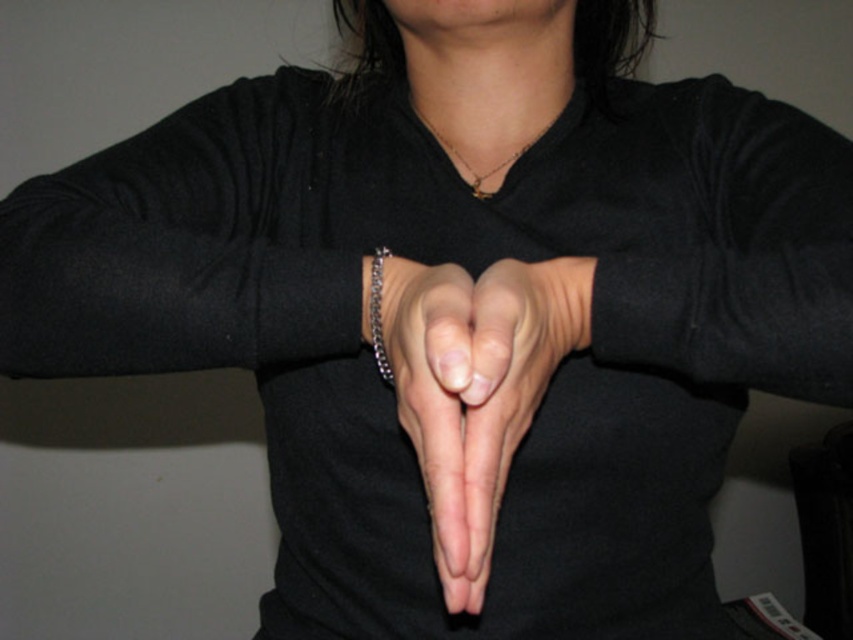
You are a photographer adjusting the lighting for a closeup shot of a person. The subject has their arms extended forward with their hands forming a heart shape. You need to ensure that the smooth skin hand at center is well lit. Based on the scene description, where should you position the main light relative to the subject?

The smooth skin hand at center is located at point (x=506, y=394), so position the main light slightly to the right and above the subject to highlight the hand effectively without casting harsh shadows.

Based on the scene description, where is the smooth skin at center positioned in terms of coordinates?

The smooth skin at center is located at point coordinates of (439, 410).

You are a photographer setting up a shoot. You need to ensure that the gold chain at center and the silver metallic bracelet at center are both visible in the final photo. Given their sizes, which one might require more careful positioning to avoid being obscured by the hands forming the heart shape?

The silver metallic bracelet at center requires more careful positioning since it is smaller in size compared to the gold chain at center, making it easier to be obscured by the hands.